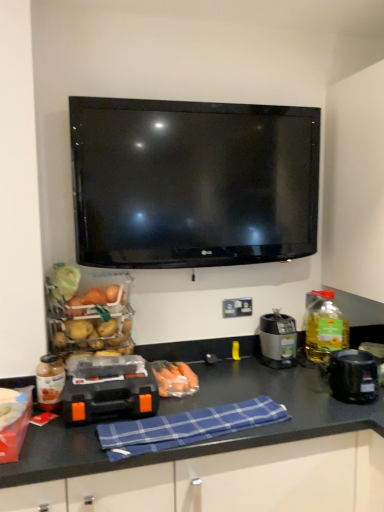
Question: Is translucent glass bottle at left, which is counted as the first bottle, starting from the left, wider than matte plastic basket of vegetables at left, acting as the first food starting from the left?

Choices:
 (A) yes
 (B) no

Answer: (B)

Question: Does translucent glass bottle at left, the second bottle when ordered from right to left, have a smaller size compared to matte plastic basket of vegetables at left, positioned as the 2th food in bottom-to-top order?

Choices:
 (A) no
 (B) yes

Answer: (B)

Question: Would you consider translucent glass bottle at left, which is counted as the first bottle, starting from the left, to be distant from matte plastic basket of vegetables at left, positioned as the 2th food in bottom-to-top order?

Choices:
 (A) no
 (B) yes

Answer: (A)

Question: Does translucent glass bottle at left, the second bottle when ordered from right to left, have a lesser height compared to matte plastic basket of vegetables at left, positioned as the 2th food in bottom-to-top order?

Choices:
 (A) yes
 (B) no

Answer: (A)

Question: From the image's perspective, is translucent glass bottle at left, marked as the 1th bottle in a front-to-back arrangement, over matte plastic basket of vegetables at left, acting as the first food starting from the left?

Choices:
 (A) yes
 (B) no

Answer: (B)

Question: From the image's perspective, is translucent glass bottle at left, which is the second bottle in back-to-front order, below matte plastic basket of vegetables at left, which appears as the second food when viewed from the right?

Choices:
 (A) yes
 (B) no

Answer: (A)

Question: From the image's perspective, is satin silver coffee maker at center-right, positioned as the 2th appliance in right-to-left order, beneath matte plastic basket of vegetables at left, placed as the 1th food when sorted from top to bottom?

Choices:
 (A) yes
 (B) no

Answer: (A)

Question: Does satin silver coffee maker at center-right, which appears as the 3th appliance when viewed from the front, come behind matte plastic basket of vegetables at left, acting as the first food starting from the left?

Choices:
 (A) yes
 (B) no

Answer: (A)

Question: From a real-world perspective, is satin silver coffee maker at center-right, positioned as the 2th appliance in right-to-left order, located higher than matte plastic basket of vegetables at left, positioned as the 2th food in bottom-to-top order?

Choices:
 (A) yes
 (B) no

Answer: (B)

Question: Does satin silver coffee maker at center-right, which is counted as the 2th appliance, starting from the left, touch matte plastic basket of vegetables at left, positioned as the 2th food in bottom-to-top order?

Choices:
 (A) no
 (B) yes

Answer: (A)

Question: From the image's perspective, does satin silver coffee maker at center-right, positioned as the 2th appliance in right-to-left order, appear higher than matte plastic basket of vegetables at left, positioned as the 2th food in bottom-to-top order?

Choices:
 (A) no
 (B) yes

Answer: (A)

Question: Can you confirm if satin silver coffee maker at center-right, positioned as the 2th appliance in right-to-left order, is bigger than matte plastic basket of vegetables at left, placed as the 1th food when sorted from top to bottom?

Choices:
 (A) yes
 (B) no

Answer: (B)

Question: Are translucent glass bottle at left, the second bottle when ordered from right to left, and blue plaid cloth at center far apart?

Choices:
 (A) no
 (B) yes

Answer: (A)